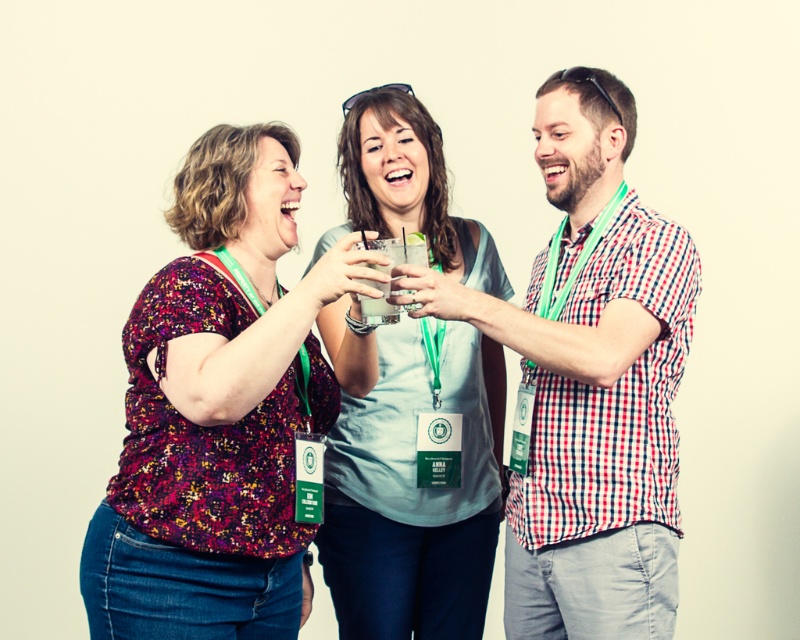
You are standing at the center of the image and want to move towards the two points labeled as point [520,586] and point [389,397]. Which point should you walk towards first to reach the one that is closer to you?

Point [520,586] is in front of point [389,397], so you should walk towards point [520,586] first since it is closer to your current position at the center.